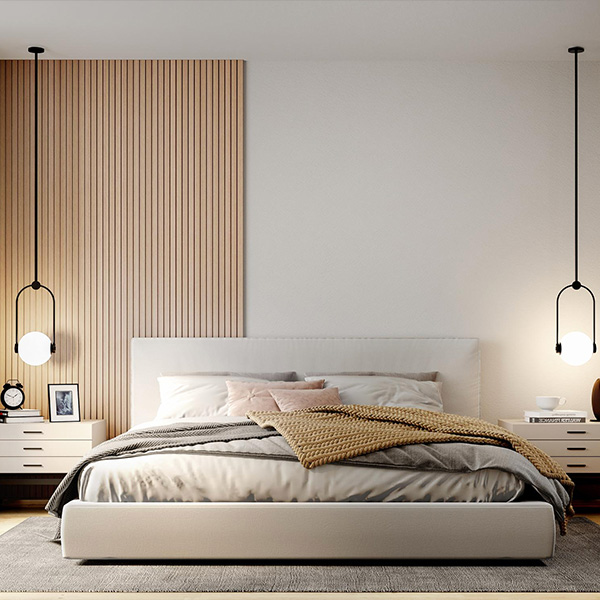
At what (x,y) coordinates should I click in order to perform the action: click on blanket. Please return your answer as a coordinate pair (x, y). The height and width of the screenshot is (600, 600). Looking at the image, I should click on (143, 441), (331, 435), (421, 454).